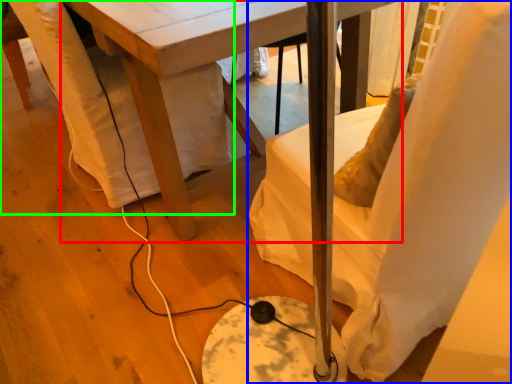
Question: Which object is the farthest from table (highlighted by a red box)? Choose among these: chair (highlighted by a blue box) or swivel chair (highlighted by a green box).

Choices:
 (A) chair
 (B) swivel chair

Answer: (A)